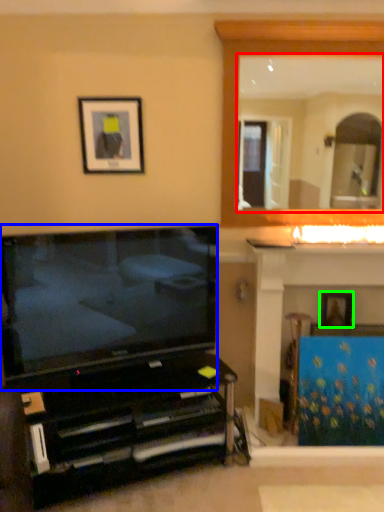
Question: Which is farther away from mirror (highlighted by a red box)? television (highlighted by a blue box) or picture frame (highlighted by a green box)?

Choices:
 (A) television
 (B) picture frame

Answer: (B)